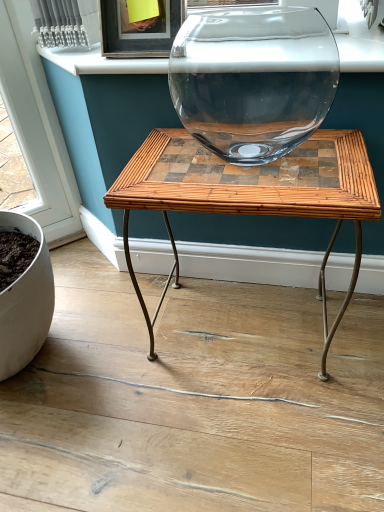
The height and width of the screenshot is (512, 384). Identify the location of free space above bamboo/rattan table at center (from a real-world perspective). (251, 155).